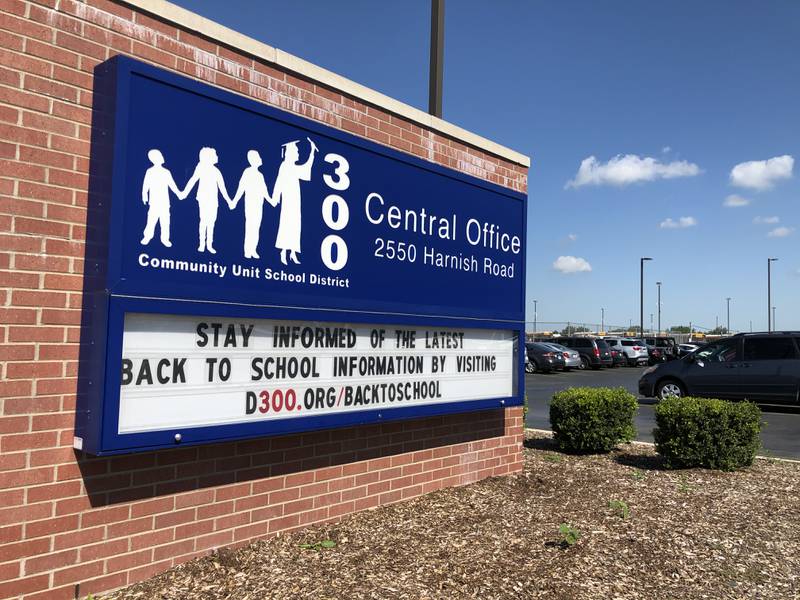
Locate an element on the screen. The height and width of the screenshot is (600, 800). red brick wall is located at coordinates (42, 151).